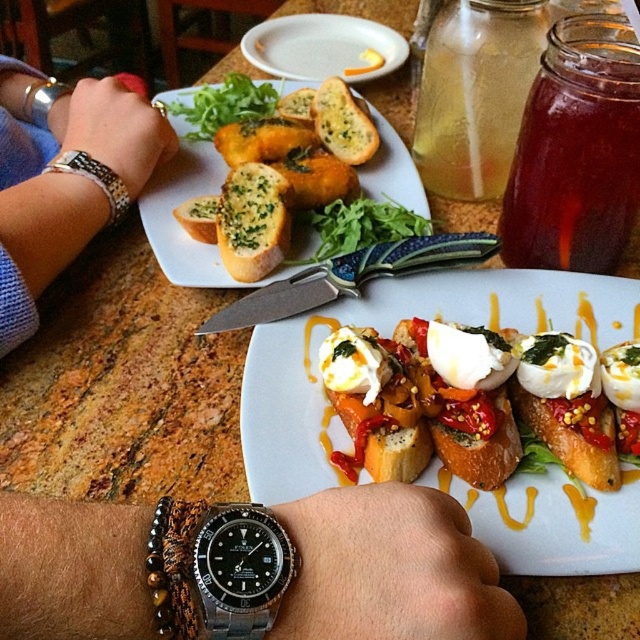
You are a guest at a dinner party and notice the white ceramic plate at center and the black metal watch at left on the table. Which object is closer to you?

Result: The white ceramic plate at center is closer to you because it is positioned under the black metal watch at left, indicating it is in front of the watch.